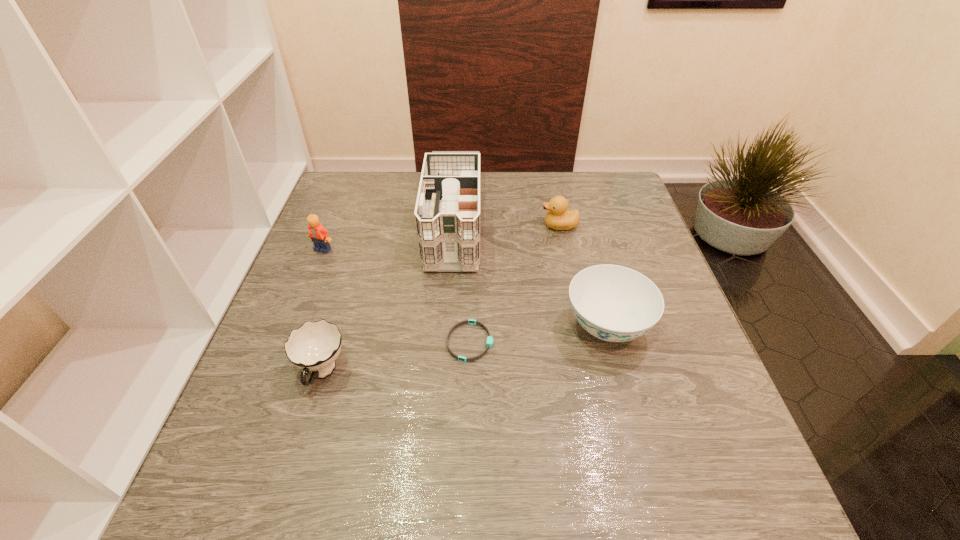
Where is `blank area in the image that satisfies the following two spatial constraints: 1. at the entrance of the chinaware; 2. on the right side of the tallest object`? This screenshot has height=540, width=960. blank area in the image that satisfies the following two spatial constraints: 1. at the entrance of the chinaware; 2. on the right side of the tallest object is located at coordinates (445, 326).